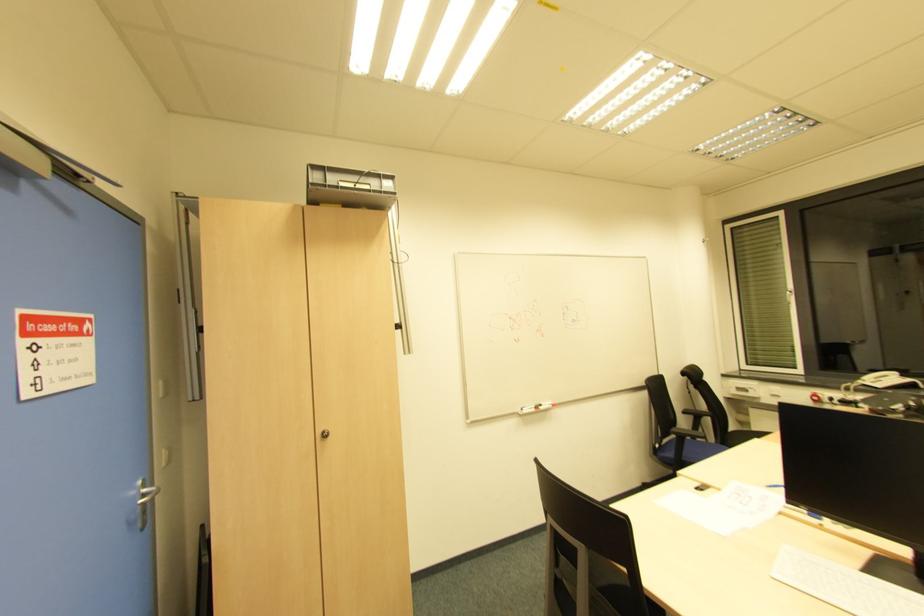
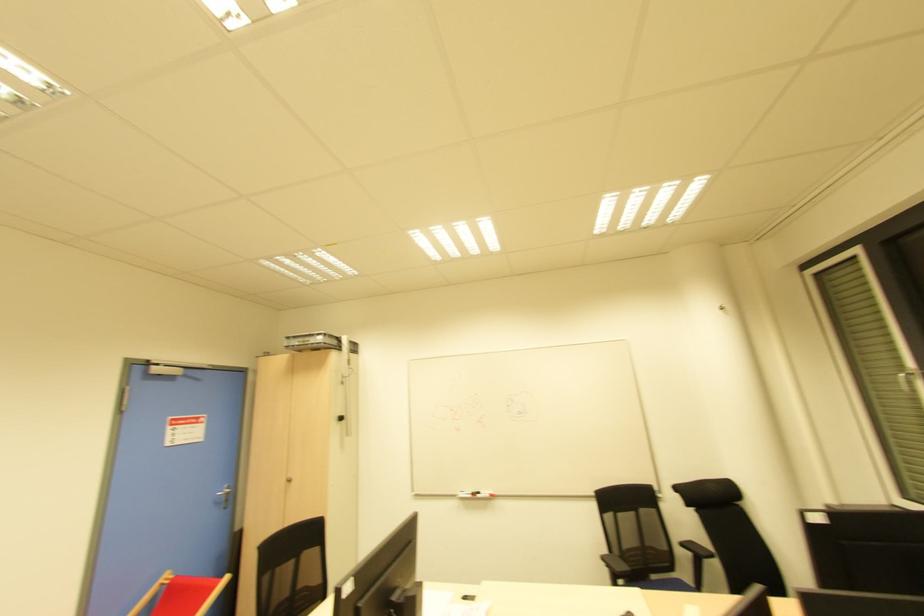
The point at (143, 513) is marked in the first image. Where is the corresponding point in the second image?

(225, 501)